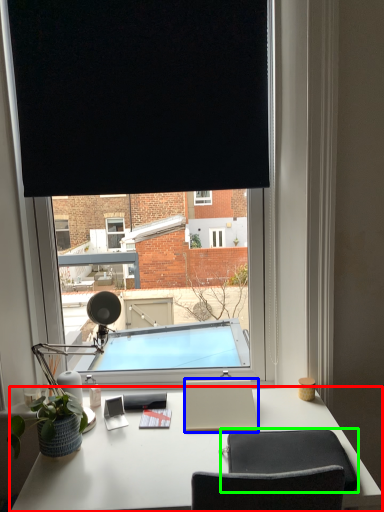
Question: Which object is the closest to the desk (highlighted by a red box)? Choose among these: notepad (highlighted by a blue box) or computer chair (highlighted by a green box).

Choices:
 (A) notepad
 (B) computer chair

Answer: (A)